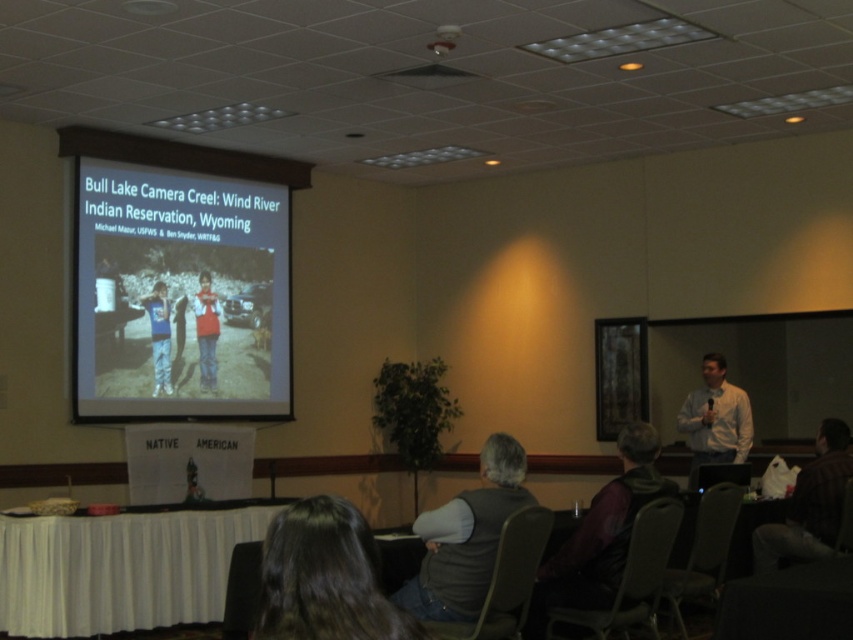
You are a photographer standing at the center of the conference room. You see the brown leather jacket at lower right. If you want to take a photo of the jacket, which direction should you move to get a better angle?

Since the brown leather jacket at lower right is located at point (809, 504), you should move to your right to get a better angle for the photo.

You are an event organizer preparing for a presentation. You need to ensure that the gray fabric vest at lower center and the red cotton shirt at center will fit on a display stand that can accommodate a maximum width of 40 cm. Based on the image, can both items fit on the stand together?

The gray fabric vest at lower center has a larger width than the red cotton shirt at center. Since the stand can only hold up to 40 cm, and the vest alone is wider than the shirt, it is possible that the combined width of both items exceeds the stand capacity. However, without knowing the exact measurements of each, we cannot confirm for sure. But according to the description, the vest is wider than the shirt. If the vest is under 40 cm, both could fit if their total width is within limit. But since the max